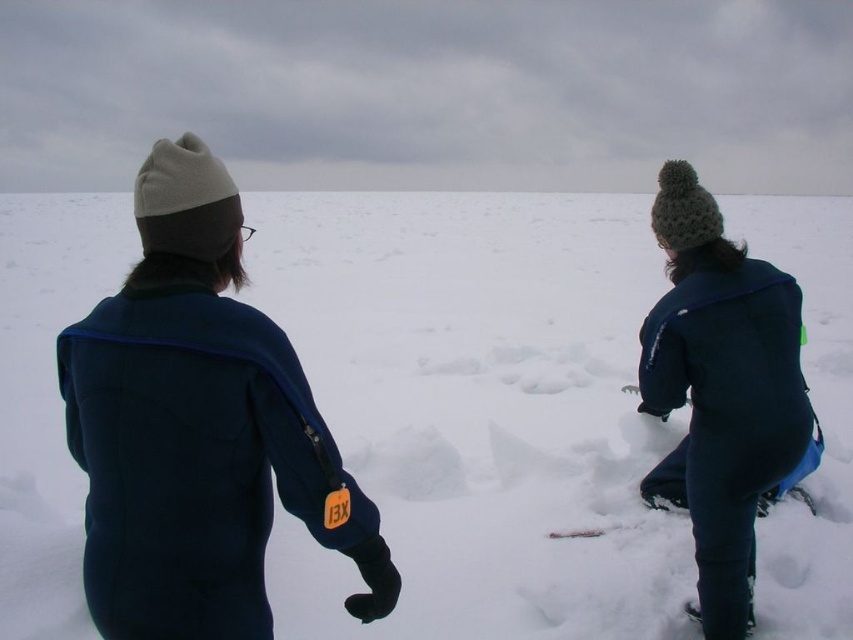
Question: Does white fluffy snow at center have a larger size compared to dark blue fleece jacket at right?

Choices:
 (A) yes
 (B) no

Answer: (A)

Question: Does dark blue fleece jacket at upper left appear on the right side of dark blue fleece jacket at right?

Choices:
 (A) yes
 (B) no

Answer: (B)

Question: Which point is closer to the camera?

Choices:
 (A) (1, 262)
 (B) (642, 352)
 (C) (96, 362)

Answer: (C)

Question: Which object is farther from the camera taking this photo?

Choices:
 (A) dark blue fleece jacket at upper left
 (B) white fluffy snow at center
 (C) dark blue fleece jacket at right

Answer: (B)

Question: Which point appears farthest from the camera in this image?

Choices:
 (A) (461, 198)
 (B) (192, 516)

Answer: (A)

Question: Can you confirm if white fluffy snow at center is positioned to the right of dark blue fleece jacket at right?

Choices:
 (A) yes
 (B) no

Answer: (A)